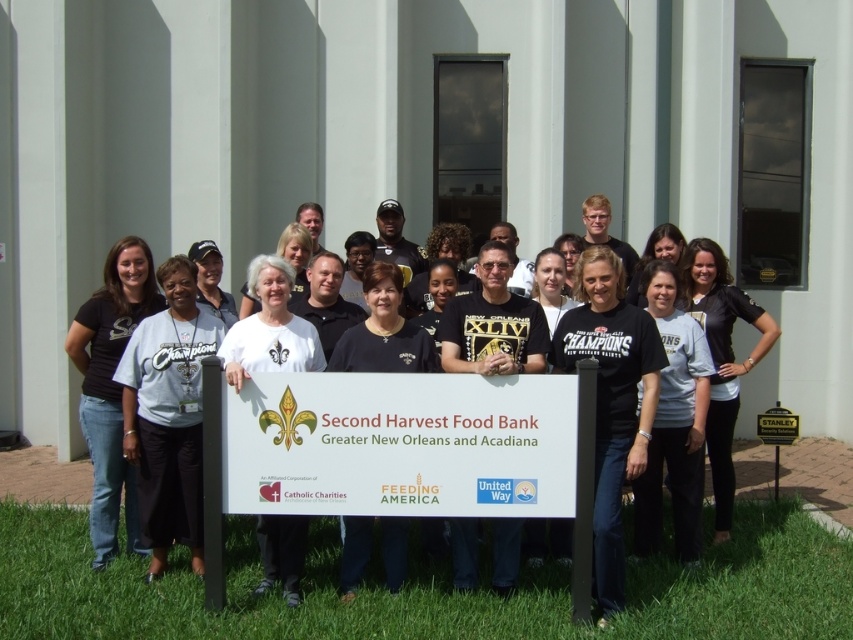
You are a photographer trying to capture a closeup of the black tshirt at left. You are currently standing at the point marked by the coordinate point (111, 387). Can you reach the black tshirt at left from your current position?

The point (111, 387) is on the black tshirt at left, so yes, you are already at the black tshirt at left.

You are a photographer trying to capture a photo of the white matte sign at center and the black matte shirt at center. Based on their sizes in the image, which object appears smaller?

The white matte sign at center appears smaller because it has a lesser height compared to the black matte shirt at center.